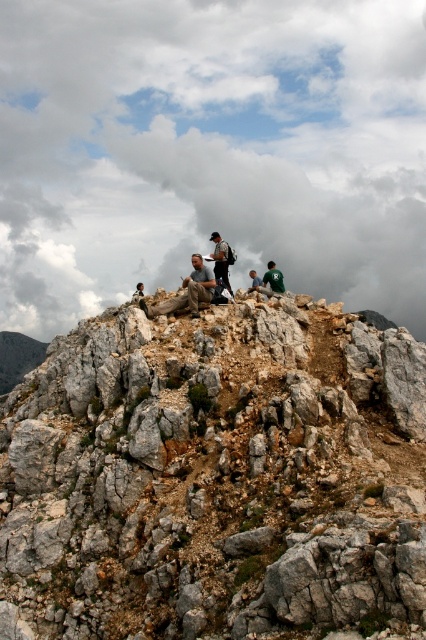
You are a hiker trying to navigate the rocky terrain. You see the gray rough rock at center and the cloudy sky at upper center. Which object is positioned to the right side of the other?

The gray rough rock at center is to the left of cloudy sky at upper center, so the cloudy sky at upper center is positioned to the right side of the gray rough rock at center.

You are a photographer standing on the rugged, rocky mountain peak. You want to take a photo that includes both the point at coordinates point [356,26] and point [215,241]. Which point should you focus on first if you want to ensure both are in sharp focus?

You should focus on point [215,241] first because it is closer to you than point [356,26], which is further away. This way, the depth of field will likely cover both points when focused on the closer one.